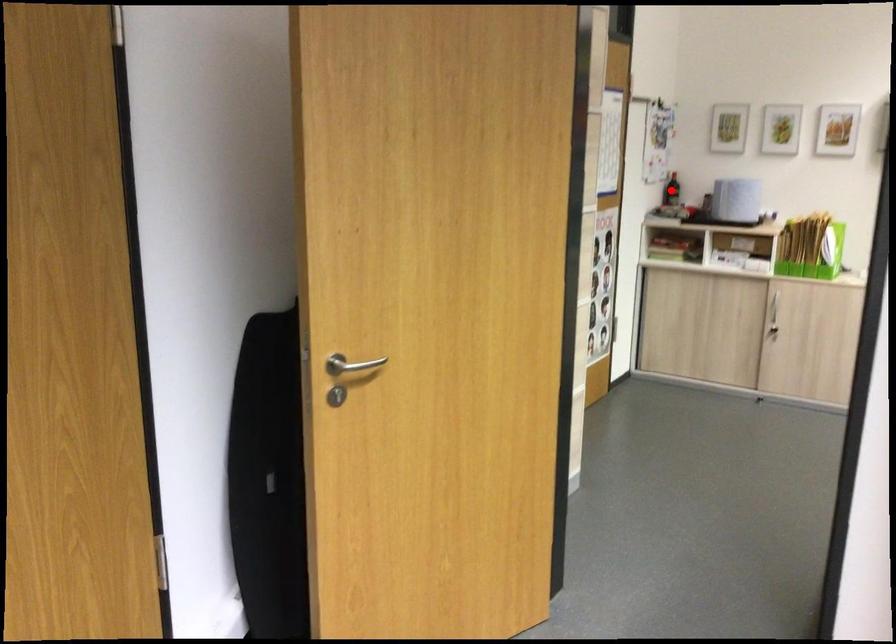
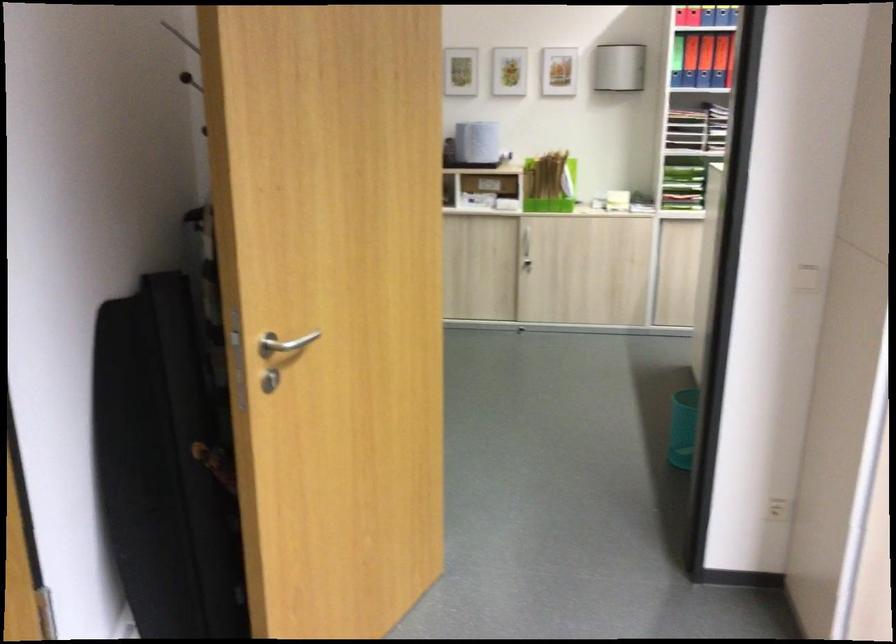
Question: I am providing you with two images of the same scene from different viewpoints. A red point is marked on the first image. Can you still see the location of the red point in image 2?

Choices:
 (A) Yes
 (B) No

Answer: (B)